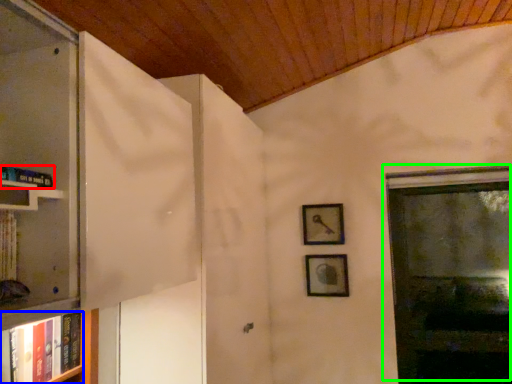
Question: Considering the real-world distances, which object is closest to book (highlighted by a red box)? book (highlighted by a blue box) or window (highlighted by a green box).

Choices:
 (A) book
 (B) window

Answer: (A)